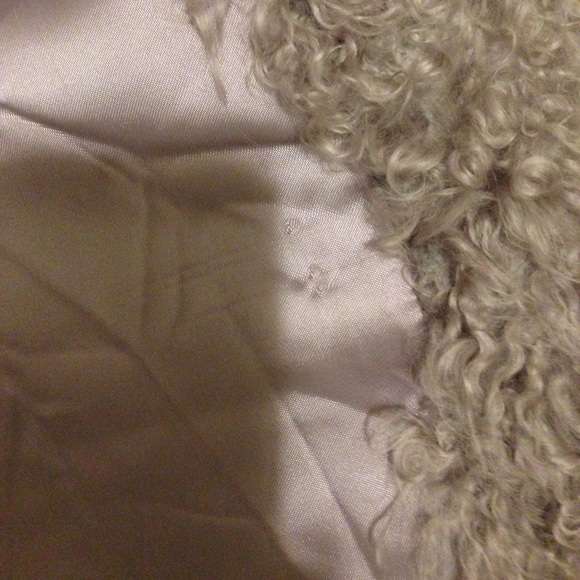
I want to click on fabric, so click(366, 470).